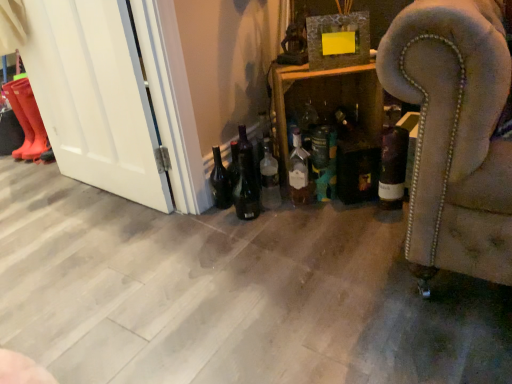
How much space does green matte bottle at center, arranged as the third bottle when viewed from the left, occupy vertically?

The height of green matte bottle at center, arranged as the third bottle when viewed from the left, is 12.63 inches.

Measure the distance between point [293,173] and camera.

Point [293,173] and camera are 5.73 feet apart.

What do you see at coordinates (344, 120) in the screenshot? I see `translucent glass bottle at center, which ranks as the 4th bottle in left-to-right order` at bounding box center [344, 120].

Where is `wooden shelf at center`? wooden shelf at center is located at coordinates (332, 116).

Describe the element at coordinates (269, 179) in the screenshot. I see `translucent glass bottle at center, which is the 5th bottle from right to left` at that location.

The image size is (512, 384). In order to click on rubber boots at left, the 2th boot viewed from the right in this screenshot , I will do `click(20, 114)`.

Considering the positions of objects wooden shelf at center and white glossy door at left in the image provided, who is behind, wooden shelf at center or white glossy door at left?

wooden shelf at center is further from the camera.

From a real-world perspective, who is located higher, wooden shelf at center or white glossy door at left?

From a 3D spatial view, white glossy door at left is above.

Considering their positions, is matte glass bottle at center, which appears as the 2th bottle when viewed from the left, located in front of or behind dark glass bottle at center-right, the 1th bottle positioned from the right?

Visually, matte glass bottle at center, which appears as the 2th bottle when viewed from the left, is located behind dark glass bottle at center-right, the 1th bottle positioned from the right.

Considering the positions of objects matte glass bottle at center, which is counted as the 4th bottle, starting from the right, and dark glass bottle at center-right, the 1th bottle positioned from the right, in the image provided, who is more to the right, matte glass bottle at center, which is counted as the 4th bottle, starting from the right, or dark glass bottle at center-right, the 1th bottle positioned from the right,?

Positioned to the right is dark glass bottle at center-right, the 1th bottle positioned from the right.

Is matte glass bottle at center, which is counted as the 4th bottle, starting from the right, wider or thinner than dark glass bottle at center-right, the 1th bottle positioned from the right?

In the image, matte glass bottle at center, which is counted as the 4th bottle, starting from the right, appears to be more narrow than dark glass bottle at center-right, the 1th bottle positioned from the right.

Based on their sizes in the image, would you say matte glass bottle at center, which is counted as the 4th bottle, starting from the right, is bigger or smaller than dark glass bottle at center-right, which ranks as the fifth bottle in left-to-right order?

Considering their sizes, matte glass bottle at center, which is counted as the 4th bottle, starting from the right, takes up less space than dark glass bottle at center-right, which ranks as the fifth bottle in left-to-right order.

Which object is further away from the camera taking this photo, dark glass bottle at center-right, which ranks as the fifth bottle in left-to-right order, or rubber boots at left, which is the 1th boot from right to left?

rubber boots at left, which is the 1th boot from right to left, is behind.

From a real-world perspective, which bottle is the 4th one underneath the rubber boots at left, which is the 1th boot from right to left? Please provide its 2D coordinates.

[(392, 163)]

Could you tell me if dark glass bottle at center-right, the 1th bottle positioned from the right, is facing rubber boots at left, which ranks as the 2th boot in left-to-right order?

No, dark glass bottle at center-right, the 1th bottle positioned from the right, is not oriented towards rubber boots at left, which ranks as the 2th boot in left-to-right order.

Consider the image. Considering the relative positions of green matte bottle at center, arranged as the third bottle when viewed from the left, and rubber boots at left, which ranks as the 2th boot in left-to-right order, in the image provided, is green matte bottle at center, arranged as the third bottle when viewed from the left, behind rubber boots at left, which ranks as the 2th boot in left-to-right order,?

No.

Considering the relative sizes of green matte bottle at center, arranged as the third bottle when viewed from the left, and rubber boots at left, which is the 1th boot from right to left, in the image provided, is green matte bottle at center, arranged as the third bottle when viewed from the left, bigger than rubber boots at left, which is the 1th boot from right to left,?

No.

Which of these two, matte glass bottle at lower left, placed as the 2th beer bottle when sorted from right to left, or black glass beer bottle at lower center, acting as the first beer bottle starting from the right, is wider?

matte glass bottle at lower left, placed as the 2th beer bottle when sorted from right to left.

Is matte glass bottle at lower left, placed as the 2th beer bottle when sorted from right to left, aimed at black glass beer bottle at lower center, which ranks as the second beer bottle in left-to-right order?

No, matte glass bottle at lower left, placed as the 2th beer bottle when sorted from right to left, does not turn towards black glass beer bottle at lower center, which ranks as the second beer bottle in left-to-right order.

Which object is closer to the camera, matte glass bottle at lower left, the 1th beer bottle from the left, or black glass beer bottle at lower center, acting as the first beer bottle starting from the right?

Positioned in front is black glass beer bottle at lower center, acting as the first beer bottle starting from the right.

Considering the relative sizes of rubber boots at left, the first boot viewed from the left, and black glass beer bottle at lower center, acting as the first beer bottle starting from the right, in the image provided, is rubber boots at left, the first boot viewed from the left, thinner than black glass beer bottle at lower center, acting as the first beer bottle starting from the right,?

Incorrect, the width of rubber boots at left, the first boot viewed from the left, is not less than that of black glass beer bottle at lower center, acting as the first beer bottle starting from the right.

Could you tell me if rubber boots at left, the first boot viewed from the left, is facing black glass beer bottle at lower center, acting as the first beer bottle starting from the right?

No, rubber boots at left, the first boot viewed from the left, is not facing towards black glass beer bottle at lower center, acting as the first beer bottle starting from the right.

Would you say rubber boots at left, the 2th boot viewed from the right, is to the left or to the right of black glass beer bottle at lower center, which ranks as the second beer bottle in left-to-right order, in the picture?

In the image, rubber boots at left, the 2th boot viewed from the right, appears on the left side of black glass beer bottle at lower center, which ranks as the second beer bottle in left-to-right order.

Would you say rubber boots at left, the 2th boot viewed from the right, is inside or outside black glass beer bottle at lower center, acting as the first beer bottle starting from the right?

rubber boots at left, the 2th boot viewed from the right, is spatially situated outside black glass beer bottle at lower center, acting as the first beer bottle starting from the right.

In terms of size, does rubber boots at left, which ranks as the 2th boot in left-to-right order, appear bigger or smaller than matte glass bottle at center, which appears as the 2th bottle when viewed from the left?

rubber boots at left, which ranks as the 2th boot in left-to-right order, is bigger than matte glass bottle at center, which appears as the 2th bottle when viewed from the left.

Is rubber boots at left, which ranks as the 2th boot in left-to-right order, turned away from matte glass bottle at center, which appears as the 2th bottle when viewed from the left?

No, rubber boots at left, which ranks as the 2th boot in left-to-right order,'s orientation is not away from matte glass bottle at center, which appears as the 2th bottle when viewed from the left.

Would you say matte glass bottle at center, which is counted as the 4th bottle, starting from the right, is part of rubber boots at left, which is the 1th boot from right to left,'s contents?

Actually, matte glass bottle at center, which is counted as the 4th bottle, starting from the right, is outside rubber boots at left, which is the 1th boot from right to left.

You are a GUI agent. You are given a task and a screenshot of the screen. Output one action in this format:
    pyautogui.click(x=<x>, y=<y>)
    Task: Click on the screen door positioned vertically above the wooden shelf at center (from a real-world perspective)
    The image size is (512, 384).
    Given the screenshot: What is the action you would take?
    pyautogui.click(x=94, y=97)

Where is `the 3rd bottle counting from the right side of the matte glass bottle at center, which is counted as the 4th bottle, starting from the right`? Image resolution: width=512 pixels, height=384 pixels. the 3rd bottle counting from the right side of the matte glass bottle at center, which is counted as the 4th bottle, starting from the right is located at coordinates (392, 163).

Estimate the real-world distances between objects in this image. Which object is further from rubber boots at left, the first boot viewed from the left, dark glass bottle at center-right, the 1th bottle positioned from the right, or translucent glass bottle at center, which ranks as the 4th bottle in left-to-right order?

Based on the image, dark glass bottle at center-right, the 1th bottle positioned from the right, appears to be further to rubber boots at left, the first boot viewed from the left.

Looking at the image, which one is located closer to rubber boots at left, the first boot viewed from the left, dark glass bottle at center-right, which ranks as the fifth bottle in left-to-right order, or translucent glass bottle at center, which is the 5th bottle from right to left?

translucent glass bottle at center, which is the 5th bottle from right to left, is positioned closer to the anchor rubber boots at left, the first boot viewed from the left.

From the image, which object appears to be farther from translucent glass bottle at center, which ranks as the 2th bottle in right-to-left order, wooden shelf at center or translucent glass bottle at center, placed as the first bottle when sorted from left to right?

translucent glass bottle at center, placed as the first bottle when sorted from left to right, lies further to translucent glass bottle at center, which ranks as the 2th bottle in right-to-left order, than the other object.

Estimate the real-world distances between objects in this image. Which object is closer to green matte bottle at center, arranged as the third bottle when viewed from the left, translucent glass bottle at center, which ranks as the 2th bottle in right-to-left order, or matte glass bottle at center, which appears as the 2th bottle when viewed from the left?

matte glass bottle at center, which appears as the 2th bottle when viewed from the left.

Considering their positions, is rubber boots at left, which ranks as the 2th boot in left-to-right order, positioned closer to black glass beer bottle at lower center, acting as the first beer bottle starting from the right, than translucent glass bottle at center, which ranks as the 2th bottle in right-to-left order?

translucent glass bottle at center, which ranks as the 2th bottle in right-to-left order, is positioned closer to the anchor black glass beer bottle at lower center, acting as the first beer bottle starting from the right.

In the scene shown: Based on their spatial positions, is matte glass bottle at lower left, the 1th beer bottle from the left, or rubber boots at left, the 2th boot viewed from the right, further from rubber boots at left, which is the 1th boot from right to left?

matte glass bottle at lower left, the 1th beer bottle from the left.

From the picture: From the image, which object appears to be farther from rubber boots at left, the 2th boot viewed from the right, white glossy door at left or dark glass bottle at center-right, the 1th bottle positioned from the right?

The object further to rubber boots at left, the 2th boot viewed from the right, is dark glass bottle at center-right, the 1th bottle positioned from the right.

Which object lies further to the anchor point matte glass bottle at lower left, the 1th beer bottle from the left, white glossy door at left or black glass beer bottle at lower center, which ranks as the second beer bottle in left-to-right order?

white glossy door at left lies further to matte glass bottle at lower left, the 1th beer bottle from the left, than the other object.

I want to click on furniture situated between black glass beer bottle at lower center, which ranks as the second beer bottle in left-to-right order, and translucent glass bottle at center, which ranks as the 4th bottle in left-to-right order, from left to right, so click(x=332, y=116).

The height and width of the screenshot is (384, 512). Identify the location of furniture situated between rubber boots at left, which ranks as the 2th boot in left-to-right order, and translucent glass bottle at center, which ranks as the 2th bottle in right-to-left order, from left to right. (332, 116).

You are a GUI agent. You are given a task and a screenshot of the screen. Output one action in this format:
    pyautogui.click(x=<x>, y=<y>)
    Task: Click on the beer bottle between matte glass bottle at lower left, the 1th beer bottle from the left, and matte glass bottle at center, which is counted as the 4th bottle, starting from the right, in the horizontal direction
    
    Given the screenshot: What is the action you would take?
    pyautogui.click(x=246, y=190)

Where is `boot between rubber boots at left, the first boot viewed from the left, and matte glass bottle at lower left, the 1th beer bottle from the left, in the horizontal direction`? boot between rubber boots at left, the first boot viewed from the left, and matte glass bottle at lower left, the 1th beer bottle from the left, in the horizontal direction is located at coordinates (33, 122).